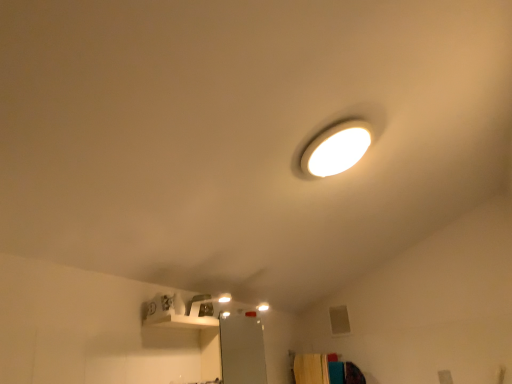
Question: From the image's perspective, relative to wooden cabinet at lower right, is white glossy lamp at upper center above or below?

Choices:
 (A) below
 (B) above

Answer: (B)

Question: From a real-world perspective, is white glossy lamp at upper center positioned above or below wooden cabinet at lower right?

Choices:
 (A) below
 (B) above

Answer: (B)

Question: Considering the positions of white glossy lamp at upper center and wooden cabinet at lower right in the image, is white glossy lamp at upper center wider or thinner than wooden cabinet at lower right?

Choices:
 (A) thin
 (B) wide

Answer: (A)

Question: Based on their positions, is wooden cabinet at lower right located to the left or right of white glossy lamp at upper center?

Choices:
 (A) left
 (B) right

Answer: (B)

Question: In the image, is wooden cabinet at lower right positioned in front of or behind white glossy lamp at upper center?

Choices:
 (A) front
 (B) behind

Answer: (B)

Question: Is wooden cabinet at lower right inside the boundaries of white glossy lamp at upper center, or outside?

Choices:
 (A) outside
 (B) inside

Answer: (A)

Question: Considering the positions of wooden cabinet at lower right and white glossy lamp at upper center in the image, is wooden cabinet at lower right wider or thinner than white glossy lamp at upper center?

Choices:
 (A) wide
 (B) thin

Answer: (A)